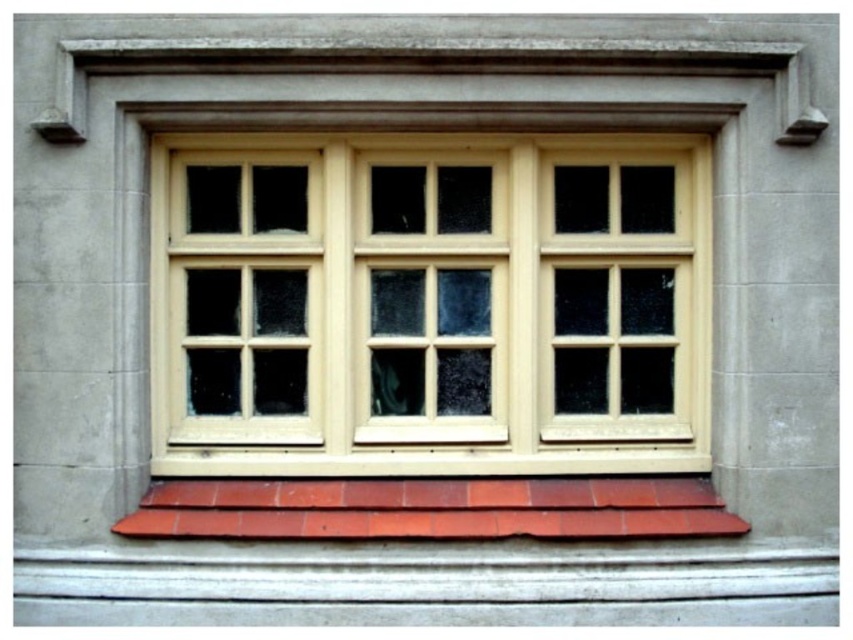
You are an architect analyzing the building facade. From your viewpoint, which object is closer to you between the matte wood window frame at center and the smooth terracotta tiles at bottom?

The matte wood window frame at center is closer to you because the smooth terracotta tiles at bottom is behind it.

Consider the image. You are standing in front of the building and notice two points marked on the window. The first point is at coordinates point (343, 141) and the second is at point (599, 508). Which point is closer to you?

Point (343, 141) is closer to you because it is further to the viewer than point (599, 508).

You are a painter standing on a ladder in front of the matte wood window frame at center and the smooth terracotta tiles at bottom. You need to paint the area between them. Which object should you paint first if you want to start from the top and work your way down?

You should start painting the matte wood window frame at center first because it is positioned over the smooth terracotta tiles at bottom, so it is higher up.